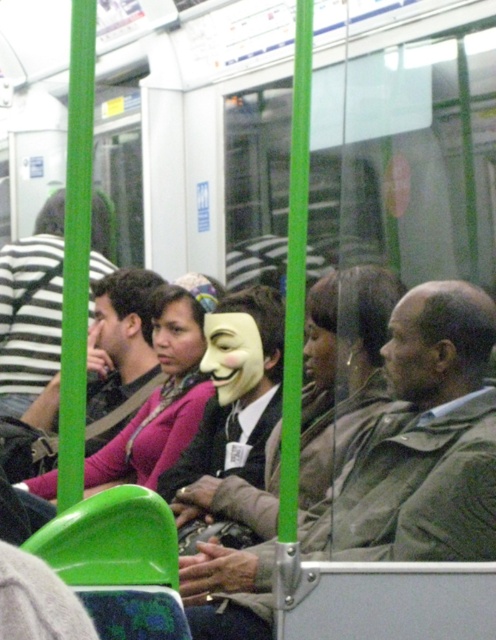
Question: Can you confirm if white matte mask at center is bigger than matte black jacket at left?

Choices:
 (A) yes
 (B) no

Answer: (B)

Question: Which point is farther to the camera?

Choices:
 (A) white matte mask at center
 (B) matte black jacket at left

Answer: (B)

Question: Is white matte mask at center closer to the viewer compared to matte black jacket at left?

Choices:
 (A) no
 (B) yes

Answer: (B)

Question: Which point is farther to the camera?

Choices:
 (A) matte black jacket at left
 (B) white matte mask at center

Answer: (A)

Question: Is white matte mask at center in front of matte black jacket at left?

Choices:
 (A) yes
 (B) no

Answer: (A)